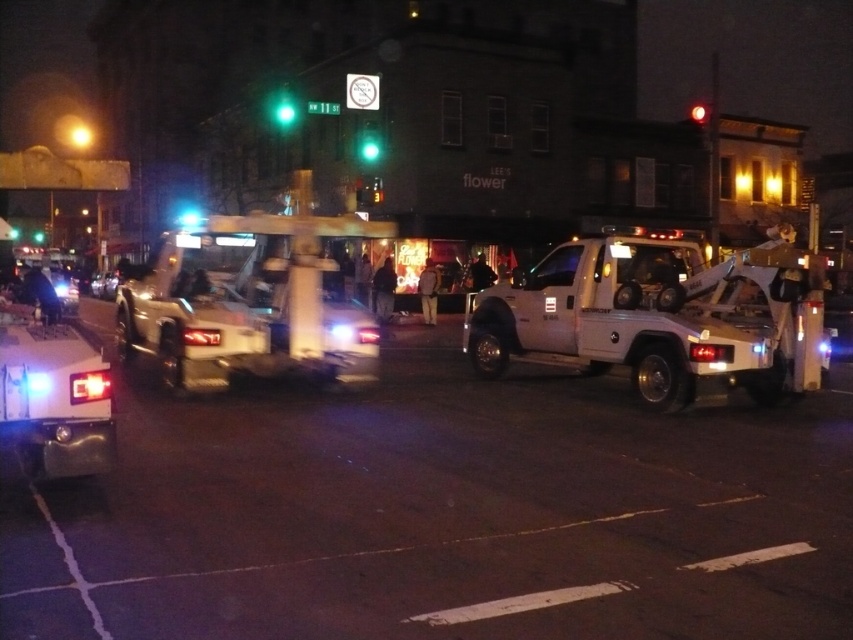
You are a delivery driver who needs to know if your 2.5m tall truck can pass under the green glass traffic light at center without hitting the white metallic tow truck at center. Can you safely drive through?

The white metallic tow truck at center is not as tall as the green glass traffic light at center, so the truck can safely pass under the traffic light without hitting the tow truck.

You are a pedestrian standing at the edge of the intersection. You see the metallic silver car at center and the green glass traffic light at upper center. Which object is closer to you?

The metallic silver car at center is closer to you because it is positioned under the green glass traffic light at upper center, indicating it is below and nearer in the scene.